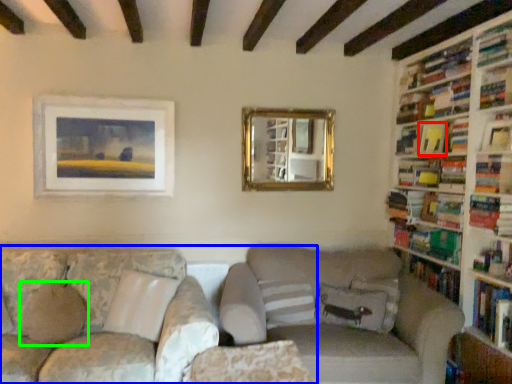
Question: Which object is the closest to the book (highlighted by a red box)? Choose among these: studio couch (highlighted by a blue box) or pillow (highlighted by a green box).

Choices:
 (A) studio couch
 (B) pillow

Answer: (A)